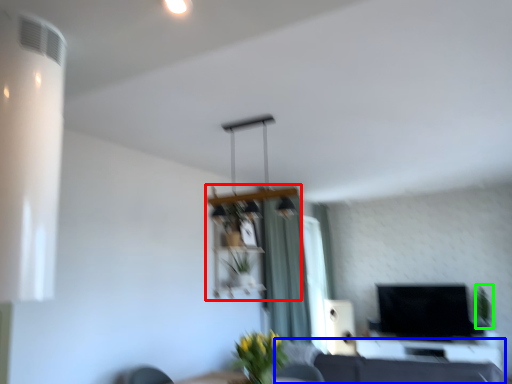
Question: Estimate the real-world distances between objects in this image. Which object is farther from shelf (highlighted by a red box), couch (highlighted by a blue box) or plant (highlighted by a green box)?

Choices:
 (A) couch
 (B) plant

Answer: (B)